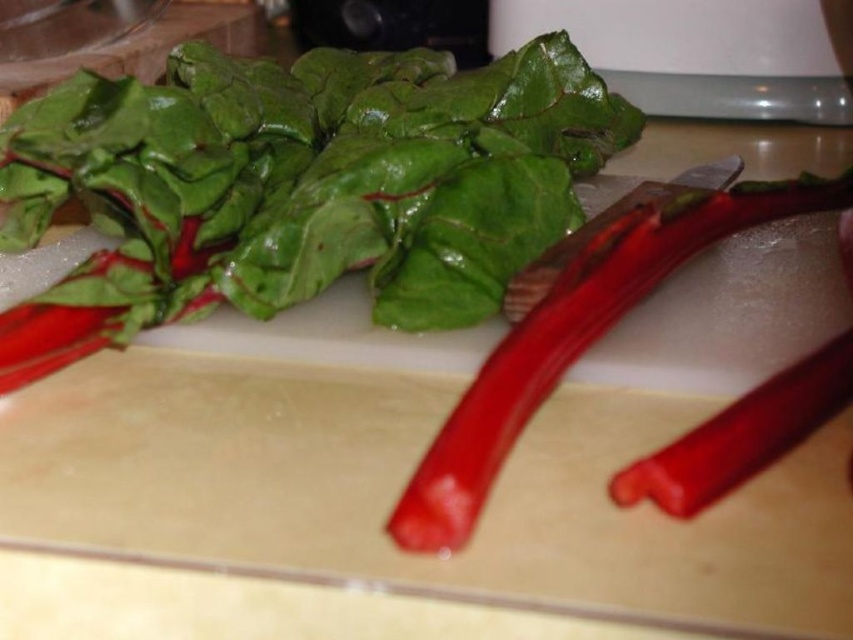
Question: In this image, where is glossy red rhubarb at upper left located relative to metallic red knife at center?

Choices:
 (A) above
 (B) below

Answer: (A)

Question: Which object is positioned closest to the beige plastic cutting board at center?

Choices:
 (A) metallic red knife at center
 (B) glossy red rhubarb at center

Answer: (B)

Question: Which of the following is the closest to the observer?

Choices:
 (A) metallic red knife at center
 (B) beige plastic cutting board at center
 (C) glossy red rhubarb at upper left

Answer: (B)

Question: Can you confirm if glossy red rhubarb at upper left is bigger than metallic red knife at center?

Choices:
 (A) yes
 (B) no

Answer: (A)

Question: Considering the real-world distances, which object is farthest from the glossy red rhubarb at center?

Choices:
 (A) glossy red rhubarb at upper left
 (B) beige plastic cutting board at center

Answer: (A)

Question: From the image, what is the correct spatial relationship of beige plastic cutting board at center in relation to metallic red knife at center?

Choices:
 (A) above
 (B) below

Answer: (B)